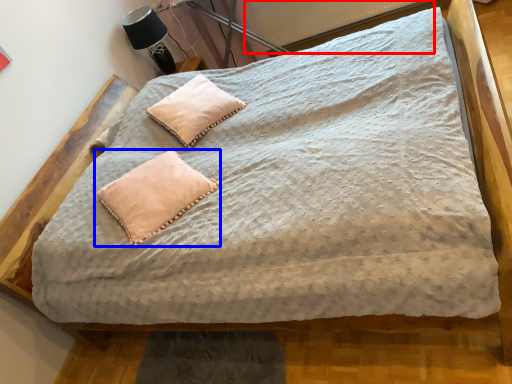
Question: Which object is further to the camera taking this photo, radiator (highlighted by a red box) or pillow (highlighted by a blue box)?

Choices:
 (A) radiator
 (B) pillow

Answer: (A)